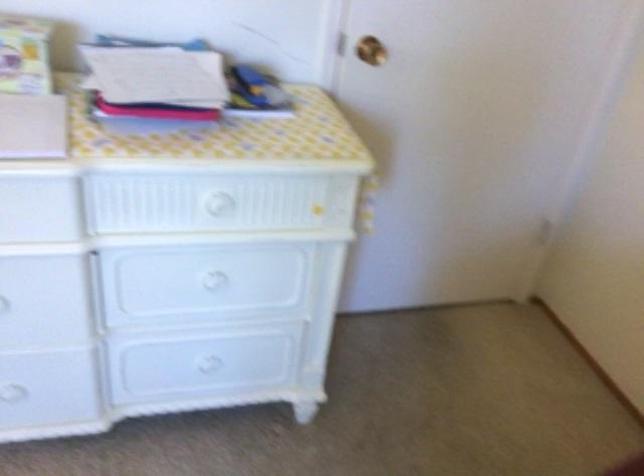
This screenshot has width=644, height=476. What are the coordinates of `brass doorknob` in the screenshot? It's located at (370, 51).